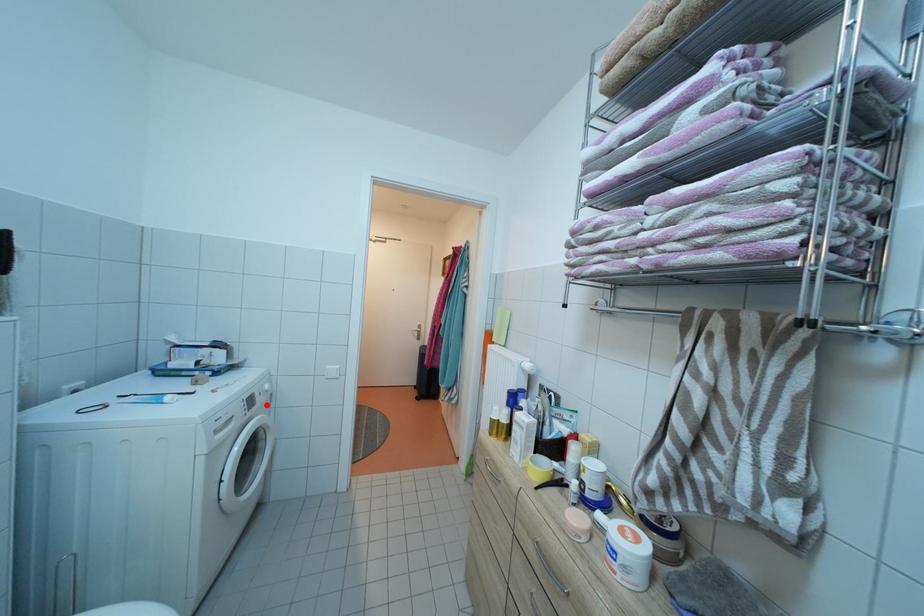
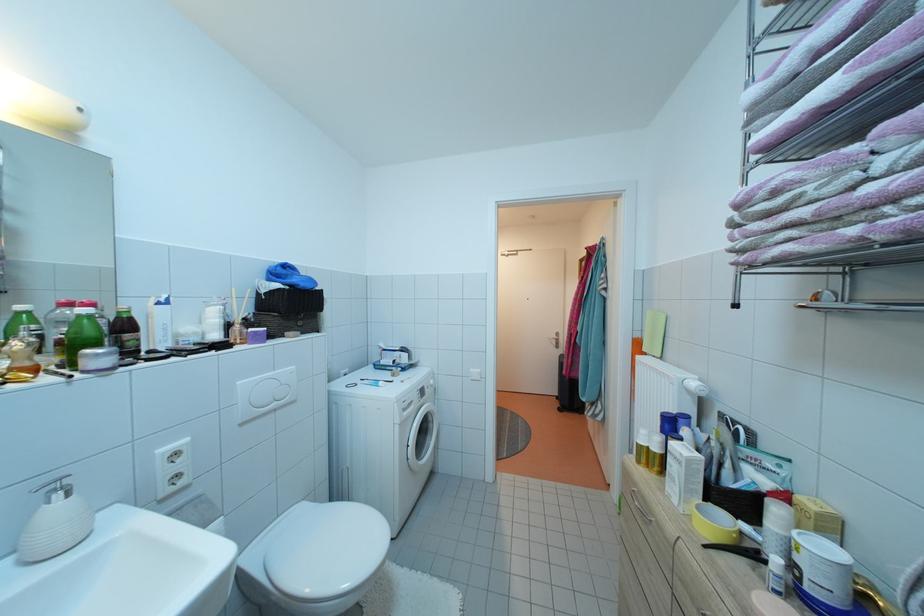
Question: A red point is marked in image1. In image2, is the corresponding 3D point closer to the camera or farther? Reply with the corresponding letter.

Choices:
 (A) The corresponding 3D point is closer.
 (B) The corresponding 3D point is farther.

Answer: (B)